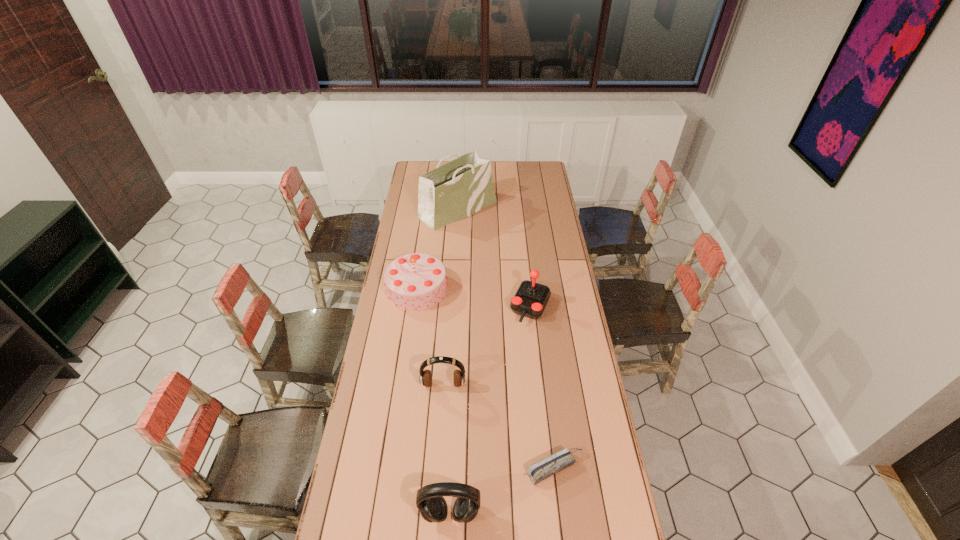
Where is `the fifth closest object to the nearer headset`? the fifth closest object to the nearer headset is located at coordinates (456, 190).

Identify which object is located as the third nearest to the birthday cake. Please provide its 2D coordinates. Your answer should be formatted as a tuple, i.e. [(x, y)], where the tuple contains the x and y coordinates of a point satisfying the conditions above.

[(425, 378)]

Locate an element on the screen. free spot that satisfies the following two spatial constraints: 1. on the back side of the grocery bag; 2. on the left side of the birthday cake is located at coordinates (428, 209).

Locate an element on the screen. Image resolution: width=960 pixels, height=540 pixels. free location that satisfies the following two spatial constraints: 1. on the ear cup of the second nearest object; 2. on the left side of the farther headset is located at coordinates (438, 468).